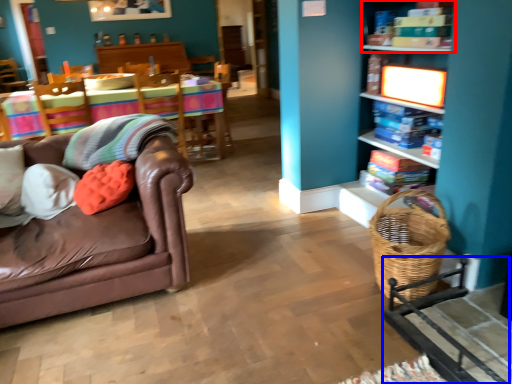
Question: Which object appears farthest to the camera in this image, shelf (highlighted by a red box) or rocking chair (highlighted by a blue box)?

Choices:
 (A) shelf
 (B) rocking chair

Answer: (A)